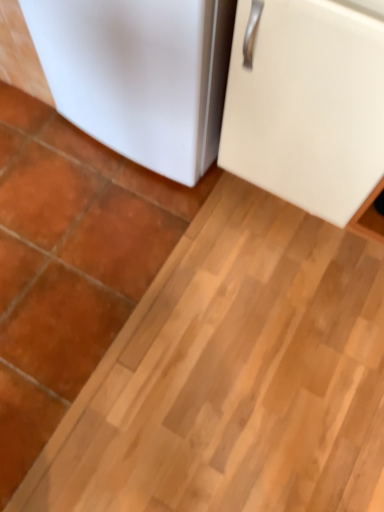
Describe the element at coordinates (140, 75) in the screenshot. I see `white matte refrigerator at lower left, the 1th refrigerator from the left` at that location.

At what (x,y) coordinates should I click in order to perform the action: click on white matte refrigerator at lower left, the 1th refrigerator from the left. Please return your answer as a coordinate pair (x, y). Looking at the image, I should click on (140, 75).

What do you see at coordinates (306, 104) in the screenshot?
I see `white matte cabinet at upper right, marked as the 1th refrigerator in a right-to-left arrangement` at bounding box center [306, 104].

Locate an element on the screen. The image size is (384, 512). white matte cabinet at upper right, marked as the 1th refrigerator in a right-to-left arrangement is located at coordinates pos(306,104).

At what (x,y) coordinates should I click in order to perform the action: click on white matte refrigerator at lower left, the 1th refrigerator from the left. Please return your answer as a coordinate pair (x, y). Looking at the image, I should click on (140, 75).

Considering the positions of objects white matte cabinet at upper right, marked as the 1th refrigerator in a right-to-left arrangement, and white matte refrigerator at lower left, the 1th refrigerator from the left, in the image provided, who is more to the right, white matte cabinet at upper right, marked as the 1th refrigerator in a right-to-left arrangement, or white matte refrigerator at lower left, the 1th refrigerator from the left,?

white matte cabinet at upper right, marked as the 1th refrigerator in a right-to-left arrangement, is more to the right.

In the scene shown: Which is behind, white matte cabinet at upper right, which appears as the 2th refrigerator when viewed from the left, or white matte refrigerator at lower left, the 1th refrigerator from the left?

white matte refrigerator at lower left, the 1th refrigerator from the left, is more distant.

Does point (304, 208) come closer to viewer compared to point (98, 10)?

No, it is not.

From the image's perspective, is white matte cabinet at upper right, which appears as the 2th refrigerator when viewed from the left, above or below white matte refrigerator at lower left, the 1th refrigerator from the left?

From the image's perspective, white matte cabinet at upper right, which appears as the 2th refrigerator when viewed from the left, appears below white matte refrigerator at lower left, the 1th refrigerator from the left.

From a real-world perspective, is white matte cabinet at upper right, marked as the 1th refrigerator in a right-to-left arrangement, under white matte refrigerator at lower left, positioned as the 2th refrigerator in right-to-left order?

No, from a real-world perspective, white matte cabinet at upper right, marked as the 1th refrigerator in a right-to-left arrangement, is not under white matte refrigerator at lower left, positioned as the 2th refrigerator in right-to-left order.

Is white matte cabinet at upper right, which appears as the 2th refrigerator when viewed from the left, wider or thinner than white matte refrigerator at lower left, positioned as the 2th refrigerator in right-to-left order?

white matte cabinet at upper right, which appears as the 2th refrigerator when viewed from the left, is thinner than white matte refrigerator at lower left, positioned as the 2th refrigerator in right-to-left order.

Considering the relative sizes of white matte cabinet at upper right, marked as the 1th refrigerator in a right-to-left arrangement, and white matte refrigerator at lower left, the 1th refrigerator from the left, in the image provided, is white matte cabinet at upper right, marked as the 1th refrigerator in a right-to-left arrangement, shorter than white matte refrigerator at lower left, the 1th refrigerator from the left,?

In fact, white matte cabinet at upper right, marked as the 1th refrigerator in a right-to-left arrangement, may be taller than white matte refrigerator at lower left, the 1th refrigerator from the left.

Does white matte cabinet at upper right, marked as the 1th refrigerator in a right-to-left arrangement, have a smaller size compared to white matte refrigerator at lower left, positioned as the 2th refrigerator in right-to-left order?

No, white matte cabinet at upper right, marked as the 1th refrigerator in a right-to-left arrangement, is not smaller than white matte refrigerator at lower left, positioned as the 2th refrigerator in right-to-left order.

Is white matte cabinet at upper right, marked as the 1th refrigerator in a right-to-left arrangement, surrounding white matte refrigerator at lower left, the 1th refrigerator from the left?

No, white matte refrigerator at lower left, the 1th refrigerator from the left, is not surrounded by white matte cabinet at upper right, marked as the 1th refrigerator in a right-to-left arrangement.

Is white matte cabinet at upper right, which appears as the 2th refrigerator when viewed from the left, next to white matte refrigerator at lower left, the 1th refrigerator from the left?

No, white matte cabinet at upper right, which appears as the 2th refrigerator when viewed from the left, is not making contact with white matte refrigerator at lower left, the 1th refrigerator from the left.

Does white matte cabinet at upper right, marked as the 1th refrigerator in a right-to-left arrangement, turn towards white matte refrigerator at lower left, positioned as the 2th refrigerator in right-to-left order?

No, white matte cabinet at upper right, marked as the 1th refrigerator in a right-to-left arrangement, does not turn towards white matte refrigerator at lower left, positioned as the 2th refrigerator in right-to-left order.

This screenshot has height=512, width=384. I want to click on refrigerator above the white matte cabinet at upper right, marked as the 1th refrigerator in a right-to-left arrangement (from the image's perspective), so click(140, 75).

Considering the positions of objects white matte refrigerator at lower left, positioned as the 2th refrigerator in right-to-left order, and white matte cabinet at upper right, which appears as the 2th refrigerator when viewed from the left, in the image provided, who is more to the right, white matte refrigerator at lower left, positioned as the 2th refrigerator in right-to-left order, or white matte cabinet at upper right, which appears as the 2th refrigerator when viewed from the left,?

From the viewer's perspective, white matte cabinet at upper right, which appears as the 2th refrigerator when viewed from the left, appears more on the right side.

Relative to white matte cabinet at upper right, marked as the 1th refrigerator in a right-to-left arrangement, is white matte refrigerator at lower left, positioned as the 2th refrigerator in right-to-left order, in front or behind?

white matte refrigerator at lower left, positioned as the 2th refrigerator in right-to-left order, is positioned farther from the viewer than white matte cabinet at upper right, marked as the 1th refrigerator in a right-to-left arrangement.

Considering the positions of point (190, 153) and point (331, 173), is point (190, 153) closer or farther from the camera than point (331, 173)?

Point (190, 153).

From the image's perspective, is white matte refrigerator at lower left, the 1th refrigerator from the left, located above or below white matte cabinet at upper right, which appears as the 2th refrigerator when viewed from the left?

Clearly, from the image's perspective, white matte refrigerator at lower left, the 1th refrigerator from the left, is above white matte cabinet at upper right, which appears as the 2th refrigerator when viewed from the left.

In the scene shown: From a real-world perspective, is white matte refrigerator at lower left, the 1th refrigerator from the left, physically located above or below white matte cabinet at upper right, marked as the 1th refrigerator in a right-to-left arrangement?

Clearly, from a real-world perspective, white matte refrigerator at lower left, the 1th refrigerator from the left, is below white matte cabinet at upper right, marked as the 1th refrigerator in a right-to-left arrangement.

Is white matte refrigerator at lower left, positioned as the 2th refrigerator in right-to-left order, wider than white matte cabinet at upper right, which appears as the 2th refrigerator when viewed from the left?

Yes, white matte refrigerator at lower left, positioned as the 2th refrigerator in right-to-left order, is wider than white matte cabinet at upper right, which appears as the 2th refrigerator when viewed from the left.

Between white matte refrigerator at lower left, the 1th refrigerator from the left, and white matte cabinet at upper right, marked as the 1th refrigerator in a right-to-left arrangement, which one has more height?

white matte cabinet at upper right, marked as the 1th refrigerator in a right-to-left arrangement.

Which of these two, white matte refrigerator at lower left, positioned as the 2th refrigerator in right-to-left order, or white matte cabinet at upper right, which appears as the 2th refrigerator when viewed from the left, is smaller?

Smaller between the two is white matte refrigerator at lower left, positioned as the 2th refrigerator in right-to-left order.

Is white matte refrigerator at lower left, positioned as the 2th refrigerator in right-to-left order, not within white matte cabinet at upper right, which appears as the 2th refrigerator when viewed from the left?

That's correct, white matte refrigerator at lower left, positioned as the 2th refrigerator in right-to-left order, is outside of white matte cabinet at upper right, which appears as the 2th refrigerator when viewed from the left.

In the scene shown: Is white matte refrigerator at lower left, positioned as the 2th refrigerator in right-to-left order, not near white matte cabinet at upper right, which appears as the 2th refrigerator when viewed from the left?

No, white matte refrigerator at lower left, positioned as the 2th refrigerator in right-to-left order, is not far from white matte cabinet at upper right, which appears as the 2th refrigerator when viewed from the left.

Could you tell me if white matte refrigerator at lower left, the 1th refrigerator from the left, is turned towards white matte cabinet at upper right, marked as the 1th refrigerator in a right-to-left arrangement?

No.

Measure the distance from white matte refrigerator at lower left, positioned as the 2th refrigerator in right-to-left order, to white matte cabinet at upper right, marked as the 1th refrigerator in a right-to-left arrangement.

white matte refrigerator at lower left, positioned as the 2th refrigerator in right-to-left order, and white matte cabinet at upper right, marked as the 1th refrigerator in a right-to-left arrangement, are 9.69 inches apart.

Where is `refrigerator located above the white matte cabinet at upper right, marked as the 1th refrigerator in a right-to-left arrangement (from the image's perspective)`? refrigerator located above the white matte cabinet at upper right, marked as the 1th refrigerator in a right-to-left arrangement (from the image's perspective) is located at coordinates (140, 75).

The image size is (384, 512). I want to click on refrigerator on the right of the white matte refrigerator at lower left, the 1th refrigerator from the left, so click(306, 104).

The width and height of the screenshot is (384, 512). In order to click on refrigerator that is under the white matte cabinet at upper right, marked as the 1th refrigerator in a right-to-left arrangement (from a real-world perspective) in this screenshot , I will do `click(140, 75)`.